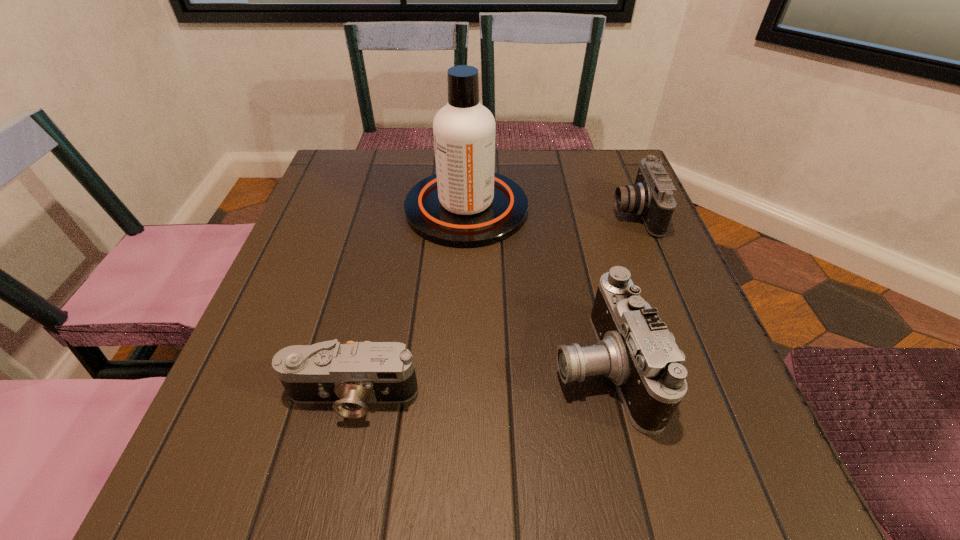
The image size is (960, 540). Find the location of `vacant space that is in between the rightmost camera and the cleansing agent`. vacant space that is in between the rightmost camera and the cleansing agent is located at coordinates point(550,211).

Where is `empty location between the second camera from right to left and the tallest object`? The width and height of the screenshot is (960, 540). empty location between the second camera from right to left and the tallest object is located at coordinates pyautogui.click(x=534, y=287).

In order to click on empty space between the cleansing agent and the second object from right to left in this screenshot , I will do `click(534, 287)`.

At what (x,y) coordinates should I click in order to perform the action: click on object that is the third closest to the leftmost camera. Please return your answer as a coordinate pair (x, y). This screenshot has width=960, height=540. Looking at the image, I should click on (651, 196).

The width and height of the screenshot is (960, 540). In order to click on object that stands as the second closest to the shortest camera in this screenshot , I will do `click(466, 204)`.

Select which camera appears as the third closest to the tallest object. Please provide its 2D coordinates. Your answer should be formatted as a tuple, i.e. [(x, y)], where the tuple contains the x and y coordinates of a point satisfying the conditions above.

[(349, 376)]

Image resolution: width=960 pixels, height=540 pixels. Identify the location of the third closest camera to the cleansing agent. (349, 376).

I want to click on free space in the image that satisfies the following two spatial constraints: 1. at the lens of the second object from right to left; 2. on the lens of the shortest object, so click(x=608, y=396).

You are a GUI agent. You are given a task and a screenshot of the screen. Output one action in this format:
    pyautogui.click(x=<x>, y=<y>)
    Task: Click on the free space in the image that satisfies the following two spatial constraints: 1. at the lens of the second camera from left to right; 2. on the lens of the shortest camera
    The height and width of the screenshot is (540, 960).
    Given the screenshot: What is the action you would take?
    pyautogui.click(x=608, y=396)